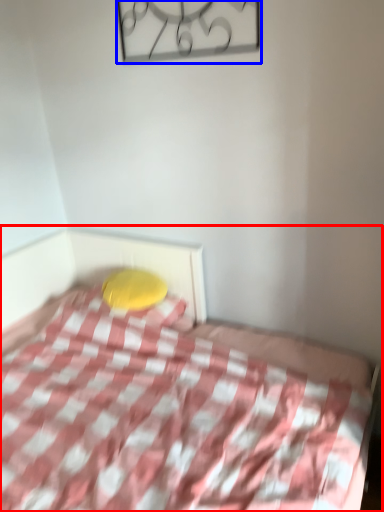
Question: Among these objects, which one is nearest to the camera, bed (highlighted by a red box) or design (highlighted by a blue box)?

Choices:
 (A) bed
 (B) design

Answer: (A)